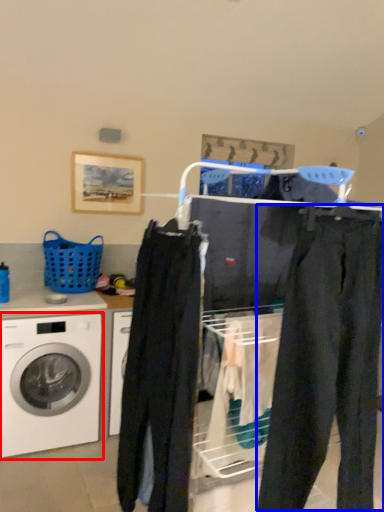
Question: Which object is further to the camera taking this photo, washing machine (highlighted by a red box) or pants (highlighted by a blue box)?

Choices:
 (A) washing machine
 (B) pants

Answer: (A)